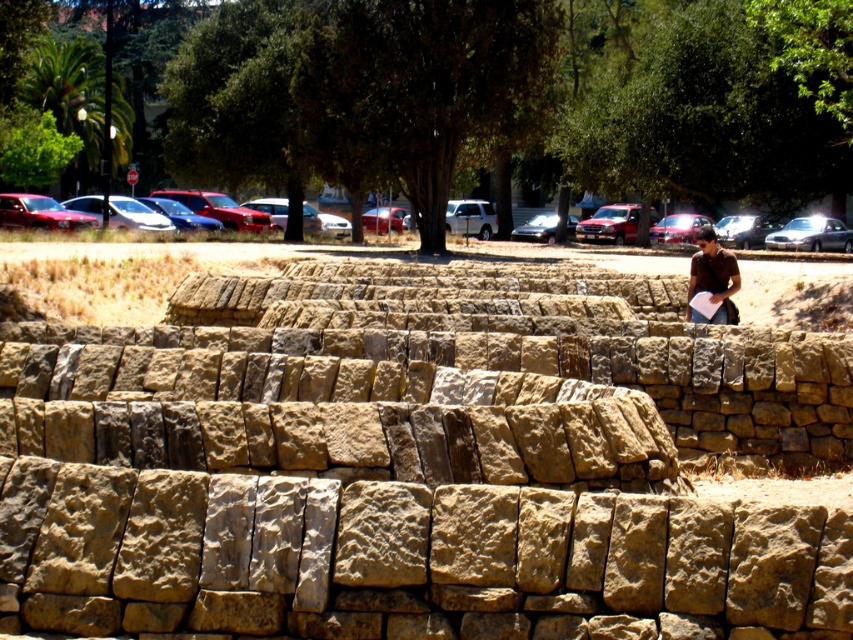
Is natural stone wall at center to the left of brown shirt at upper right from the viewer's perspective?

Correct, you'll find natural stone wall at center to the left of brown shirt at upper right.

Does natural stone wall at center have a lesser width compared to brown shirt at upper right?

Correct, natural stone wall at center's width is less than brown shirt at upper right's.

Which is in front, point (61, 516) or point (724, 305)?

Point (61, 516)

The image size is (853, 640). Find the location of `natural stone wall at center`. natural stone wall at center is located at coordinates (412, 467).